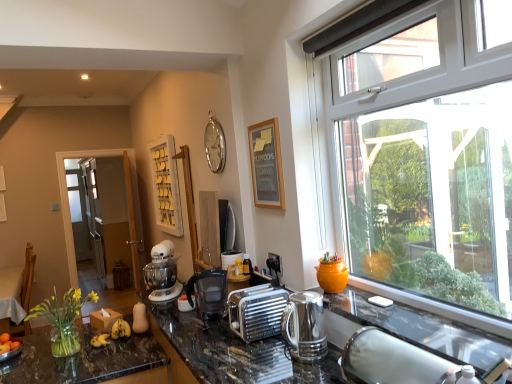
Where is `free space to the right of yellow matte bananas at center`? free space to the right of yellow matte bananas at center is located at coordinates (141, 339).